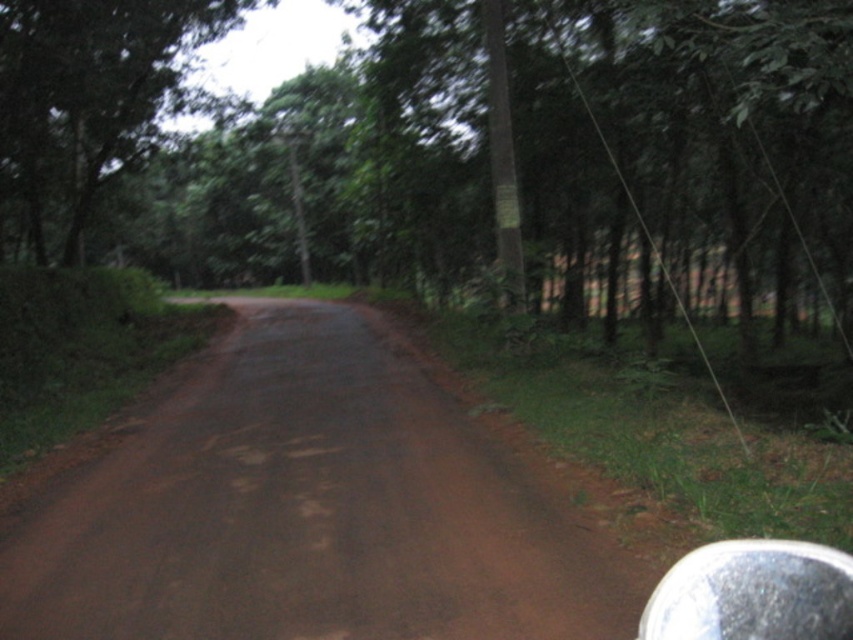
Question: Which of the following is the farthest from the observer?

Choices:
 (A) (171, 83)
 (B) (192, 625)

Answer: (A)

Question: Estimate the real-world distances between objects in this image. Which object is closer to the green matte tree at right?

Choices:
 (A) brown dirt track at center
 (B) green leafy tree at upper left

Answer: (A)

Question: Is green leafy tree at upper left bigger than green matte tree at right?

Choices:
 (A) no
 (B) yes

Answer: (A)

Question: Estimate the real-world distances between objects in this image. Which object is closer to the brown dirt track at center?

Choices:
 (A) green leafy tree at upper left
 (B) green matte tree at right

Answer: (B)

Question: Does green leafy tree at upper left appear under green matte tree at right?

Choices:
 (A) no
 (B) yes

Answer: (A)

Question: Considering the relative positions of brown dirt track at center and green leafy tree at upper left in the image provided, where is brown dirt track at center located with respect to green leafy tree at upper left?

Choices:
 (A) above
 (B) below

Answer: (B)